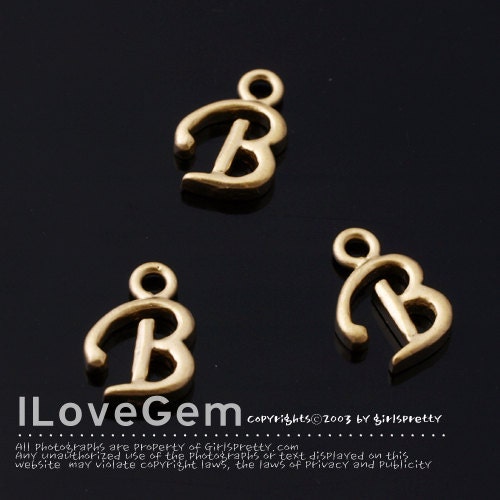
At what (x,y) coordinates should I click in order to perform the action: click on "b" pendant. Please return your answer as a coordinate pair (x, y). This screenshot has width=500, height=500. Looking at the image, I should click on (243, 150), (382, 310), (138, 342).